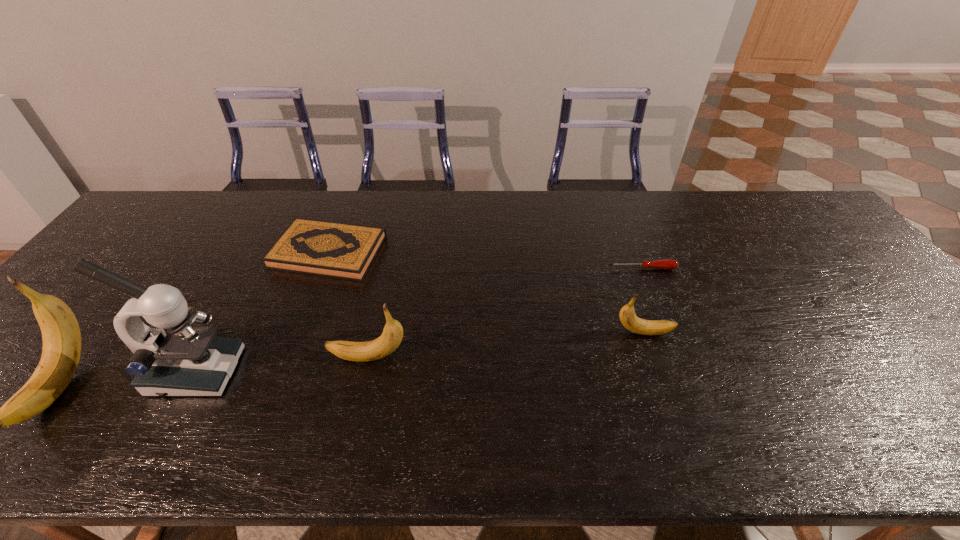
All bananas are currently evenly spaced. To continue this pattern, where would you add another banana on the right? Please point out a vacant spot. Please provide its 2D coordinates. Your answer should be formatted as a tuple, i.e. [(x, y)], where the tuple contains the x and y coordinates of a point satisfying the conditions above.

[(893, 309)]